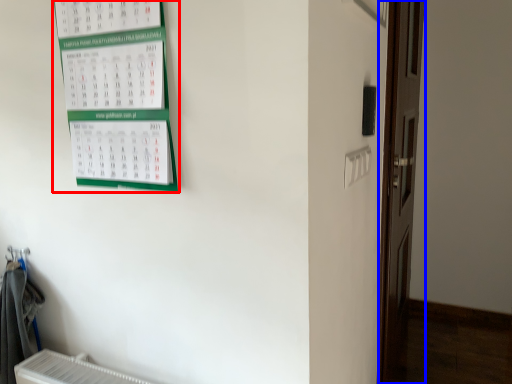
Question: Among these objects, which one is farthest to the camera, bulletin board (highlighted by a red box) or door (highlighted by a blue box)?

Choices:
 (A) bulletin board
 (B) door

Answer: (B)